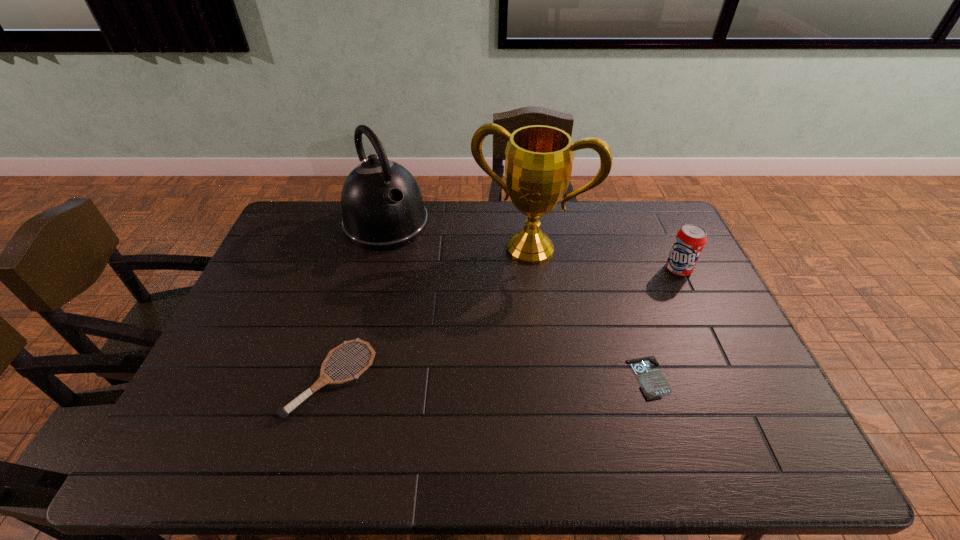
Locate an element on the screen. free space on the desktop that is between the second shortest object and the fourth object from left to right and is positioned on the front-facing side of the award is located at coordinates (484, 379).

The image size is (960, 540). Find the location of `free space on the desktop that is between the tennis racket and the identity card and is positioned on the surface of the third shortest object`. free space on the desktop that is between the tennis racket and the identity card and is positioned on the surface of the third shortest object is located at coordinates (470, 379).

This screenshot has height=540, width=960. Identify the location of vacant space on the desktop that is between the tennis racket and the shortest object and is positioned on the spout of the kettle. (508, 379).